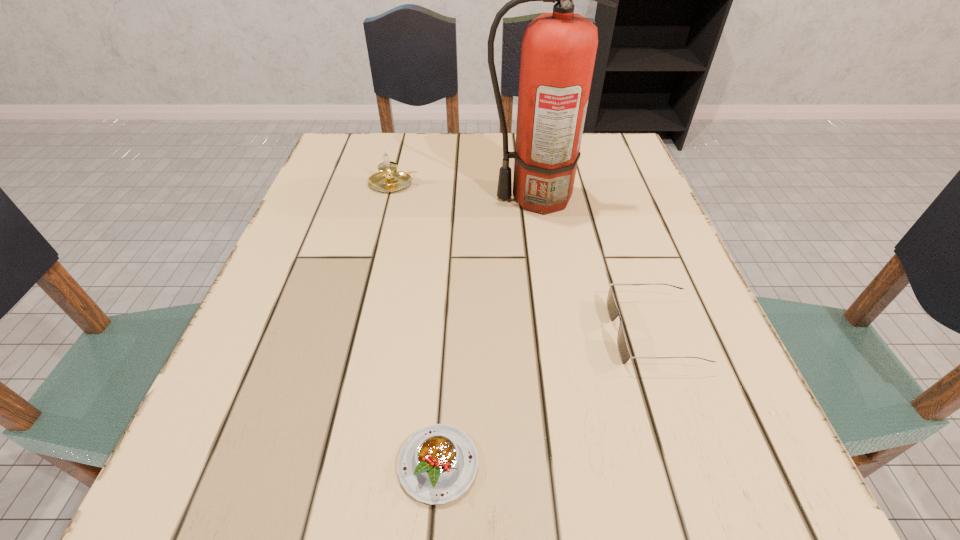
Locate an element on the screen. The height and width of the screenshot is (540, 960). free space between the second nearest object and the third shortest object is located at coordinates (524, 258).

Identify the location of vacant area that lies between the second nearest object and the pudding. (546, 399).

I want to click on free space that is in between the second tallest object and the tallest object, so click(465, 191).

Where is `unoccupied position between the pudding and the leftmost object`? The height and width of the screenshot is (540, 960). unoccupied position between the pudding and the leftmost object is located at coordinates point(416,324).

The image size is (960, 540). Identify the location of vacant area that lies between the nearest object and the fire extinguisher. (487, 331).

In order to click on vacant area that lies between the candle holder and the third object from right to left in this screenshot , I will do `click(416, 324)`.

Where is `free spot between the leftmost object and the pudding`? free spot between the leftmost object and the pudding is located at coordinates (416, 324).

You are a GUI agent. You are given a task and a screenshot of the screen. Output one action in this format:
    pyautogui.click(x=<x>, y=<y>)
    Task: Click on the vacant area that lies between the pudding and the fire extinguisher
    This screenshot has width=960, height=540.
    Given the screenshot: What is the action you would take?
    pyautogui.click(x=487, y=331)

Identify which object is the second nearest to the leftmost object. Please provide its 2D coordinates. Your answer should be formatted as a tuple, i.e. [(x, y)], where the tuple contains the x and y coordinates of a point satisfying the conditions above.

[(613, 312)]

Image resolution: width=960 pixels, height=540 pixels. Find the location of `object that is the second nearest to the nearest object`. object that is the second nearest to the nearest object is located at coordinates (558, 50).